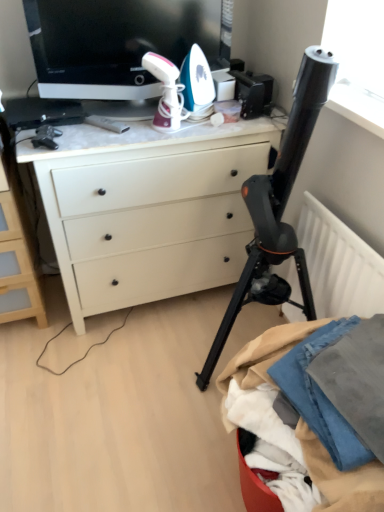
This screenshot has height=512, width=384. In order to click on free area in between white matte desk at center and black matte tripod at center in this screenshot , I will do `click(150, 361)`.